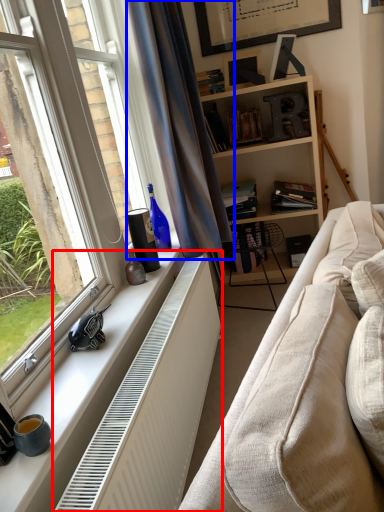
Question: Among these objects, which one is farthest to the camera, radiator (highlighted by a red box) or curtain (highlighted by a blue box)?

Choices:
 (A) radiator
 (B) curtain

Answer: (B)